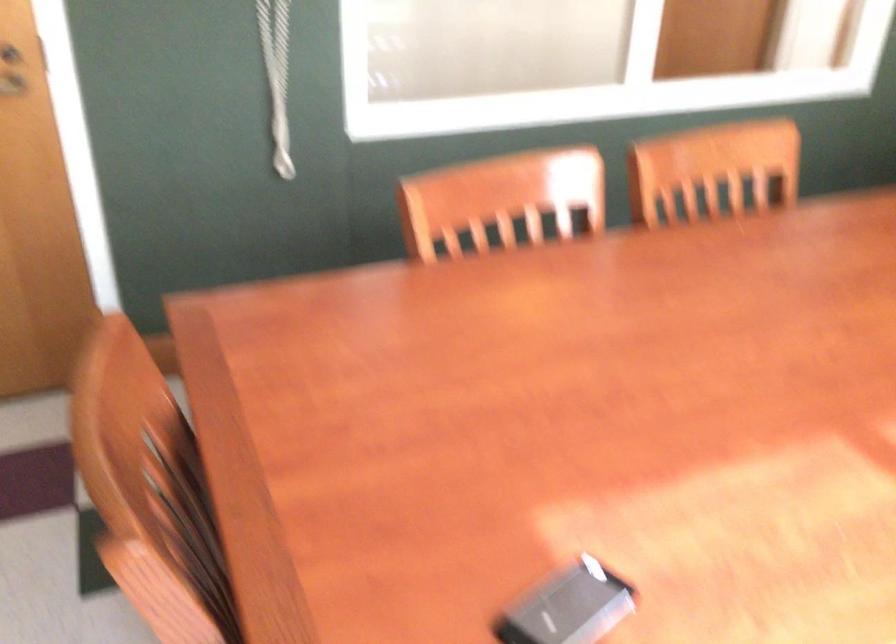
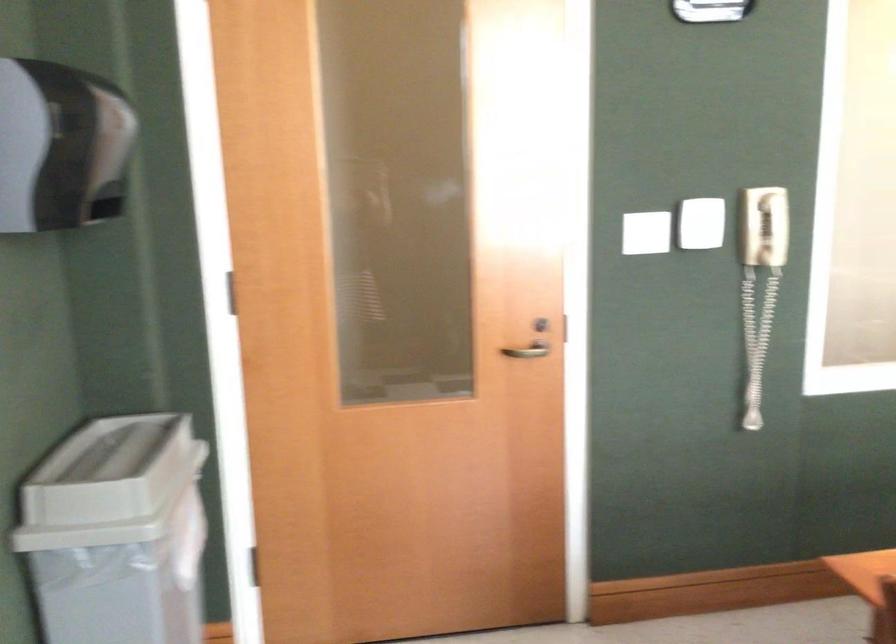
In a continuous first-person perspective shot, in which direction is the camera moving?

The movement direction of the cameraman is left, backward.